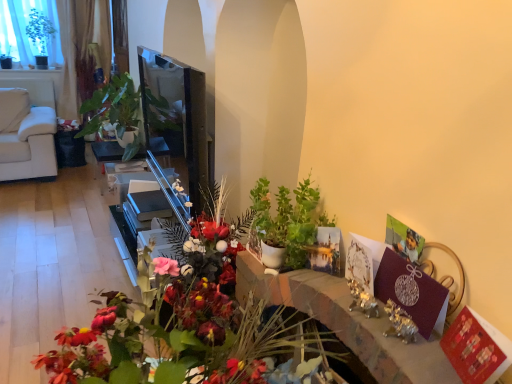
Question: Is the depth of matte black table at center greater than that of green matte plant at center, which is counted as the 2th houseplant, starting from the top?

Choices:
 (A) yes
 (B) no

Answer: (A)

Question: From the image's perspective, does matte black table at center appear higher than green matte plant at center, acting as the first houseplant starting from the bottom?

Choices:
 (A) no
 (B) yes

Answer: (B)

Question: Does matte black table at center have a lesser width compared to green matte plant at center, placed as the second houseplant when sorted from left to right?

Choices:
 (A) no
 (B) yes

Answer: (A)

Question: Is matte black table at center shorter than green matte plant at center, placed as the 1th houseplant when sorted from front to back?

Choices:
 (A) no
 (B) yes

Answer: (B)

Question: Considering the relative sizes of matte black table at center and green matte plant at center, positioned as the 2th houseplant in back-to-front order, in the image provided, is matte black table at center smaller than green matte plant at center, positioned as the 2th houseplant in back-to-front order,?

Choices:
 (A) no
 (B) yes

Answer: (A)

Question: Considering the positions of point (81, 365) and point (12, 16), is point (81, 365) closer or farther from the camera than point (12, 16)?

Choices:
 (A) farther
 (B) closer

Answer: (B)

Question: Is matte floral arrangement at center inside the boundaries of green leafy plant at upper left, or outside?

Choices:
 (A) inside
 (B) outside

Answer: (B)

Question: Looking at the image, does matte floral arrangement at center seem bigger or smaller compared to green leafy plant at upper left?

Choices:
 (A) small
 (B) big

Answer: (B)

Question: In terms of width, does matte floral arrangement at center look wider or thinner when compared to green leafy plant at upper left?

Choices:
 (A) thin
 (B) wide

Answer: (B)

Question: From a real-world perspective, is green matte plant at center, placed as the first houseplant when sorted from right to left, positioned above or below matte floral arrangement at center?

Choices:
 (A) below
 (B) above

Answer: (B)

Question: Would you say green matte plant at center, positioned as the 2th houseplant in back-to-front order, is to the left or to the right of matte floral arrangement at center in the picture?

Choices:
 (A) right
 (B) left

Answer: (A)

Question: In terms of width, does green matte plant at center, positioned as the 2th houseplant in back-to-front order, look wider or thinner when compared to matte floral arrangement at center?

Choices:
 (A) thin
 (B) wide

Answer: (A)

Question: Considering the positions of green matte plant at center, placed as the 1th houseplant when sorted from front to back, and matte floral arrangement at center in the image, is green matte plant at center, placed as the 1th houseplant when sorted from front to back, taller or shorter than matte floral arrangement at center?

Choices:
 (A) short
 (B) tall

Answer: (A)

Question: Looking at their shapes, would you say green matte plant at center, positioned as the 2th houseplant in back-to-front order, is wider or thinner than matte black table at center?

Choices:
 (A) thin
 (B) wide

Answer: (A)

Question: Considering the positions of green matte plant at center, which is counted as the 2th houseplant, starting from the top, and matte black table at center in the image, is green matte plant at center, which is counted as the 2th houseplant, starting from the top, taller or shorter than matte black table at center?

Choices:
 (A) short
 (B) tall

Answer: (B)